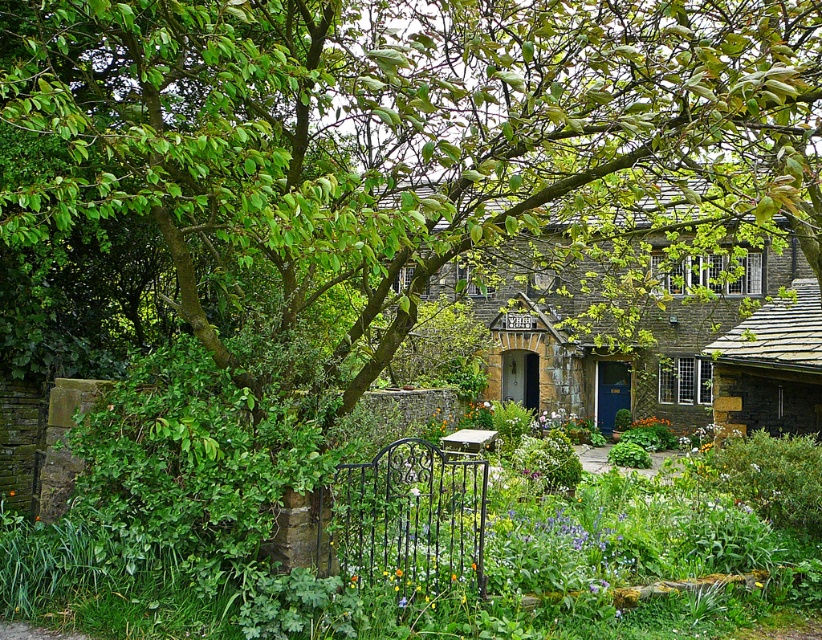
You are standing in the garden of the rustic stone house and want to take a photo of both the green leafy bush at lower left and the brown stone cottage at center. Which object should you focus on first to ensure both are in clear view?

You should focus on the green leafy bush at lower left first because it is closer to the viewer than the brown stone cottage at center, so adjusting focus from near to far will help capture both clearly.

You are a visitor approaching the brown stone cottage at center and notice a green leafy bush at lower left nearby. Which object is taller?

The brown stone cottage at center is taller than the green leafy bush at lower left.

In the scene shown: You are a gardener planning to plant a new tree that requires a space larger than the green leafy bush at lower left. Based on the scene, is there enough space near the brown stone cottage at center to accommodate this tree?

The green leafy bush at lower left is smaller than the brown stone cottage at center, so there is likely enough space near the brown stone cottage at center to plant the new tree since the cottage is larger and may have more available space.